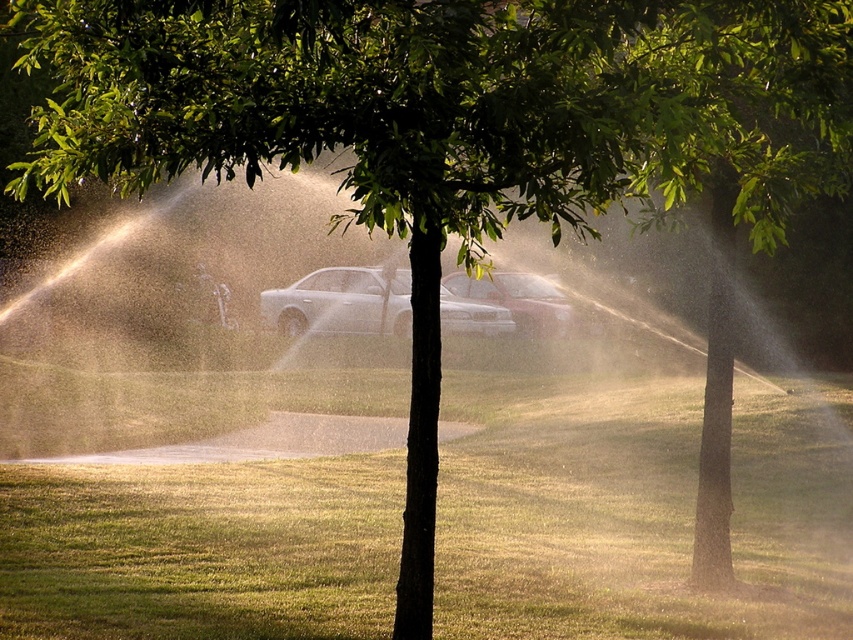
Can you confirm if satin silver sedan at center is taller than metallic silver sedan at center?

No, satin silver sedan at center is not taller than metallic silver sedan at center.

Who is positioned more to the left, satin silver sedan at center or metallic silver sedan at center?

Positioned to the left is satin silver sedan at center.

Is point (286, 316) more distant than point (569, 317)?

Yes, it is behind point (569, 317).

The height and width of the screenshot is (640, 853). I want to click on satin silver sedan at center, so click(326, 301).